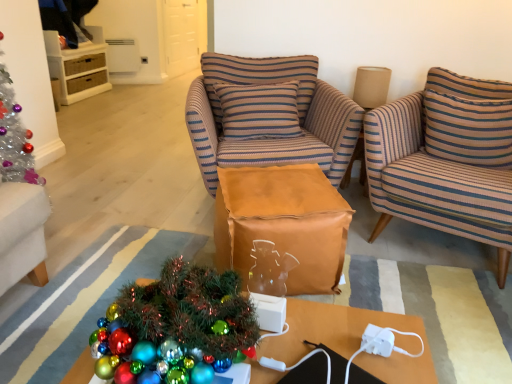
Question: Is striped fabric armchair at right, placed as the 2th chair when sorted from left to right, closer to the viewer compared to brown paper bag at center?

Choices:
 (A) no
 (B) yes

Answer: (B)

Question: Is the depth of striped fabric armchair at right, positioned as the first chair in right-to-left order, greater than that of brown paper bag at center?

Choices:
 (A) no
 (B) yes

Answer: (A)

Question: Can you confirm if striped fabric armchair at right, positioned as the first chair in right-to-left order, is wider than brown paper bag at center?

Choices:
 (A) no
 (B) yes

Answer: (B)

Question: Would you say brown paper bag at center is part of striped fabric armchair at right, placed as the 2th chair when sorted from left to right,'s contents?

Choices:
 (A) no
 (B) yes

Answer: (A)

Question: Is striped fabric armchair at right, positioned as the first chair in right-to-left order, to the right of brown paper bag at center from the viewer's perspective?

Choices:
 (A) yes
 (B) no

Answer: (A)

Question: From a real-world perspective, is striped fabric armchair at right, placed as the 2th chair when sorted from left to right, positioned above or below shiny metallic desk at lower center?

Choices:
 (A) above
 (B) below

Answer: (A)

Question: From the image's perspective, is striped fabric armchair at right, positioned as the first chair in right-to-left order, above or below shiny metallic desk at lower center?

Choices:
 (A) below
 (B) above

Answer: (B)

Question: Is striped fabric armchair at right, placed as the 2th chair when sorted from left to right, spatially inside shiny metallic desk at lower center, or outside of it?

Choices:
 (A) inside
 (B) outside

Answer: (B)

Question: Visually, is striped fabric armchair at right, placed as the 2th chair when sorted from left to right, positioned to the left or to the right of shiny metallic desk at lower center?

Choices:
 (A) right
 (B) left

Answer: (A)

Question: Is striped fabric pillow at center, the first pillow from the left, situated inside shiny metallic desk at lower center or outside?

Choices:
 (A) outside
 (B) inside

Answer: (A)

Question: In terms of height, does striped fabric pillow at center, the first pillow from the left, look taller or shorter compared to shiny metallic desk at lower center?

Choices:
 (A) short
 (B) tall

Answer: (B)

Question: In the image, is striped fabric pillow at center, the first pillow from the left, positioned in front of or behind shiny metallic desk at lower center?

Choices:
 (A) behind
 (B) front

Answer: (A)

Question: Looking at their shapes, would you say striped fabric pillow at center, the first pillow from the left, is wider or thinner than shiny metallic desk at lower center?

Choices:
 (A) thin
 (B) wide

Answer: (A)

Question: Visually, is brown paper bag at center positioned to the left or to the right of brown striped armchair at center, the 1th chair when ordered from left to right?

Choices:
 (A) right
 (B) left

Answer: (A)

Question: Is point (245, 228) positioned closer to the camera than point (256, 91)?

Choices:
 (A) farther
 (B) closer

Answer: (B)